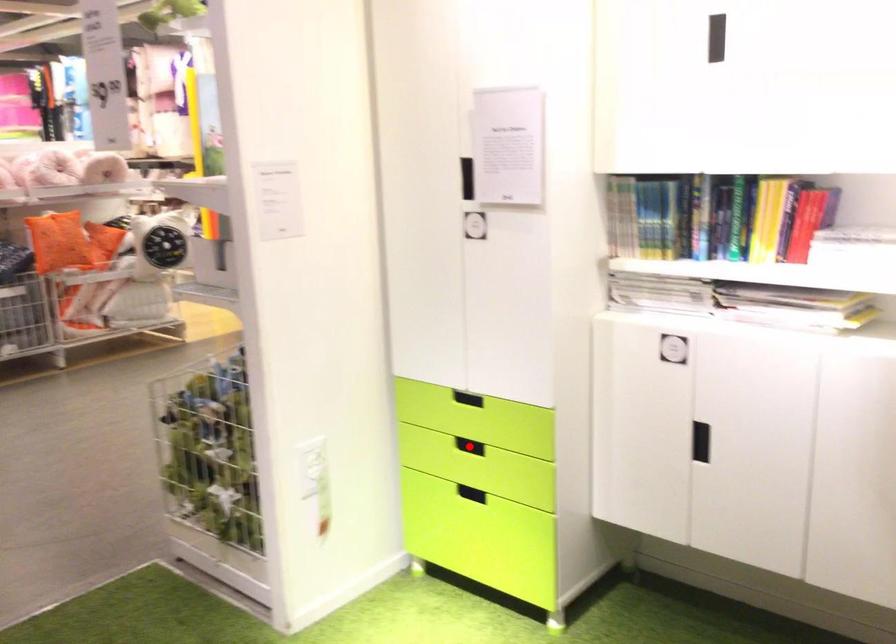
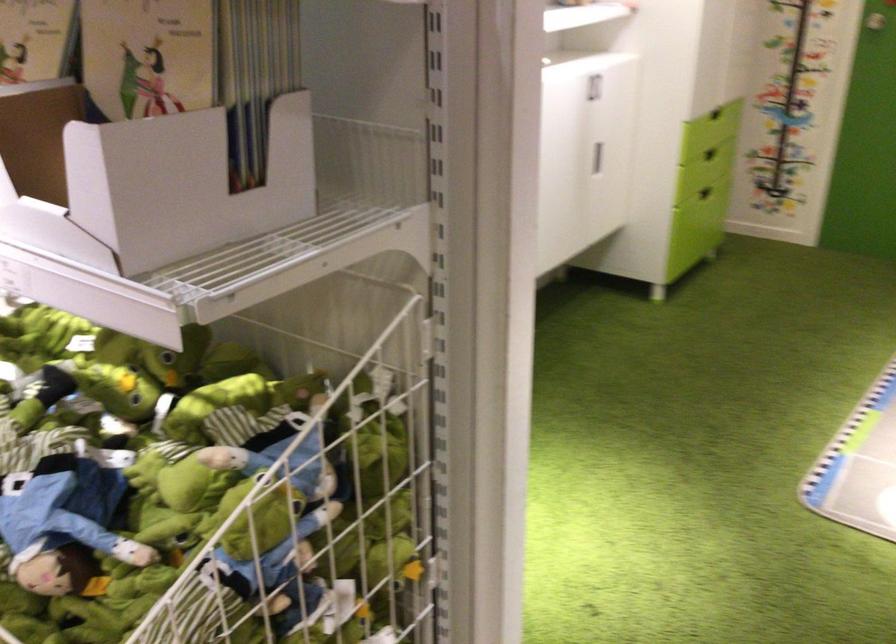
Question: I am providing you with two images of the same scene from different viewpoints. A red point is marked on the first image. At the location where the point appears in image 1, is it still visible in image 2?

Choices:
 (A) Yes
 (B) No

Answer: (B)